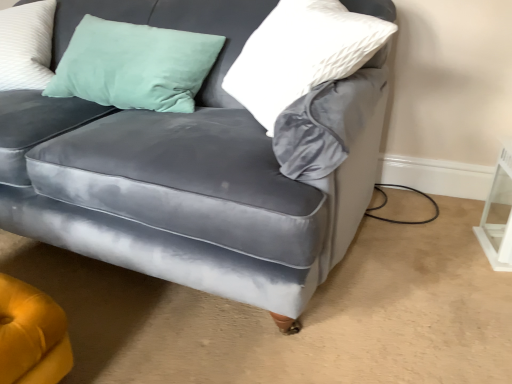
Question: Should I look upward or downward to see white textured pillow at upper right?

Choices:
 (A) up
 (B) down

Answer: (A)

Question: Does white textured pillow at upper right have a greater height compared to white glossy table at lower right?

Choices:
 (A) yes
 (B) no

Answer: (A)

Question: Does white textured pillow at upper right appear on the right side of white glossy table at lower right?

Choices:
 (A) no
 (B) yes

Answer: (A)

Question: Considering the relative positions of white textured pillow at upper right and white glossy table at lower right in the image provided, is white textured pillow at upper right to the left of white glossy table at lower right from the viewer's perspective?

Choices:
 (A) no
 (B) yes

Answer: (B)

Question: Does white textured pillow at upper right have a lesser width compared to white glossy table at lower right?

Choices:
 (A) yes
 (B) no

Answer: (A)

Question: From a real-world perspective, is white textured pillow at upper right below white glossy table at lower right?

Choices:
 (A) yes
 (B) no

Answer: (B)

Question: Is white textured pillow at upper right facing away from white glossy table at lower right?

Choices:
 (A) yes
 (B) no

Answer: (A)

Question: Does velvet gray couch at center have a lesser width compared to white textured pillow at upper right?

Choices:
 (A) yes
 (B) no

Answer: (B)

Question: Is velvet gray couch at center far away from white textured pillow at upper right?

Choices:
 (A) no
 (B) yes

Answer: (A)

Question: Can you confirm if velvet gray couch at center is shorter than white textured pillow at upper right?

Choices:
 (A) yes
 (B) no

Answer: (B)

Question: Does velvet gray couch at center have a greater height compared to white textured pillow at upper right?

Choices:
 (A) no
 (B) yes

Answer: (B)

Question: Is velvet gray couch at center next to white textured pillow at upper right and touching it?

Choices:
 (A) no
 (B) yes

Answer: (A)

Question: Is velvet gray couch at center closer to the viewer compared to white textured pillow at upper right?

Choices:
 (A) yes
 (B) no

Answer: (A)

Question: Considering the relative sizes of white textured pillow at upper right and velvet gray couch at center in the image provided, is white textured pillow at upper right thinner than velvet gray couch at center?

Choices:
 (A) no
 (B) yes

Answer: (B)